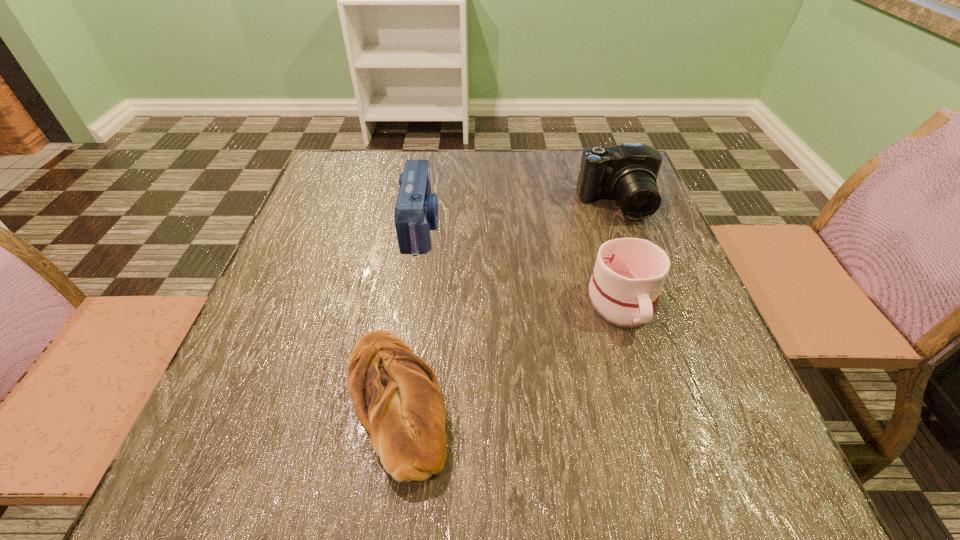
Find the location of a particular element. free area in between the mug and the bread is located at coordinates [510, 353].

Locate an element on the screen. This screenshot has width=960, height=540. empty space that is in between the bread and the left camera is located at coordinates (409, 315).

Image resolution: width=960 pixels, height=540 pixels. I want to click on free space between the right camera and the left camera, so click(519, 216).

Find the location of a particular element. This screenshot has height=540, width=960. free point between the right camera and the bread is located at coordinates (506, 303).

Identify the location of free space between the mug and the bread. (510, 353).

In order to click on vacant point located between the left camera and the right camera in this screenshot , I will do `click(519, 216)`.

Where is `vacant area between the shortest object and the right camera`? vacant area between the shortest object and the right camera is located at coordinates (506, 303).

Where is `object identified as the closest to the left camera`? The width and height of the screenshot is (960, 540). object identified as the closest to the left camera is located at coordinates (396, 395).

Locate which object ranks third in proximity to the bread. Please provide its 2D coordinates. Your answer should be formatted as a tuple, i.e. [(x, y)], where the tuple contains the x and y coordinates of a point satisfying the conditions above.

[(627, 173)]

Find the location of a particular element. vacant space that satisfies the following two spatial constraints: 1. on the lens of the right camera; 2. on the lens of the left camera is located at coordinates (625, 227).